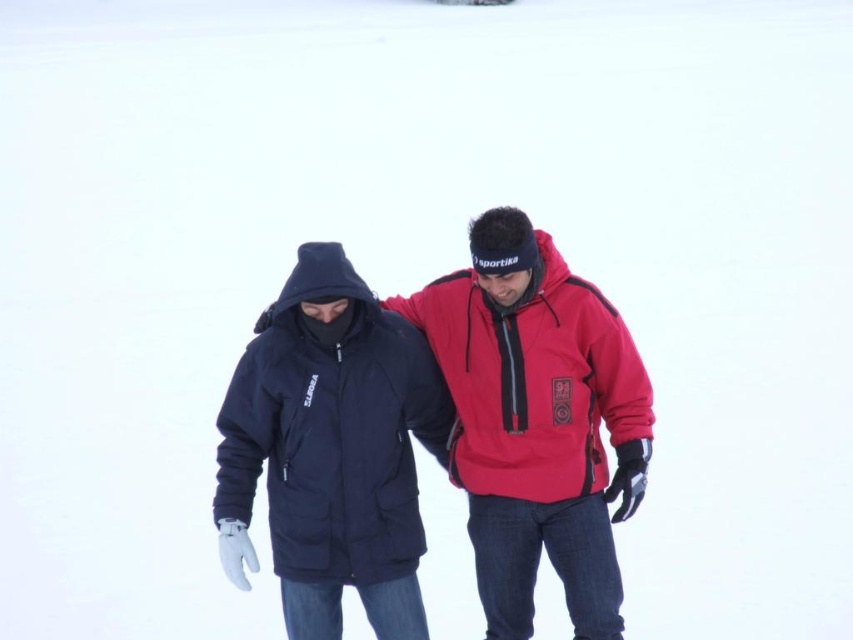
Is matte black jacket at center bigger than matte red jacket at center?

Yes.

The width and height of the screenshot is (853, 640). In order to click on matte black jacket at center in this screenshot , I will do `click(537, 420)`.

This screenshot has height=640, width=853. Describe the element at coordinates (537, 420) in the screenshot. I see `matte black jacket at center` at that location.

What do you see at coordinates (537, 420) in the screenshot? I see `matte black jacket at center` at bounding box center [537, 420].

What are the coordinates of `matte black jacket at center` in the screenshot? It's located at (537, 420).

The height and width of the screenshot is (640, 853). In order to click on navy blue softshell jacket at center in this screenshot , I will do `click(329, 432)`.

Based on the photo, which is above, navy blue softshell jacket at center or matte red jacket at center?

matte red jacket at center

Is point (352, 397) more distant than point (517, 326)?

No, it is in front of (517, 326).

Locate an element on the screen. This screenshot has width=853, height=640. navy blue softshell jacket at center is located at coordinates (329, 432).